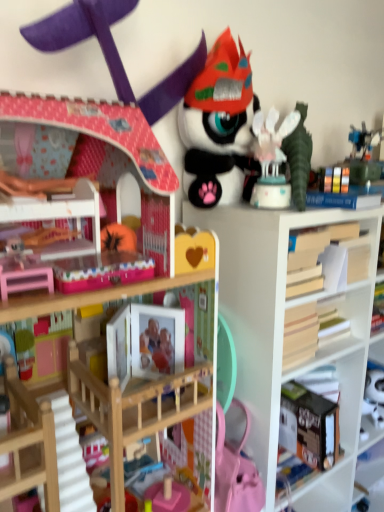
Question: Based on their positions, is wooden book at right located to the left or right of matte pink dollhouse at upper left, the third toy when ordered from right to left?

Choices:
 (A) right
 (B) left

Answer: (A)

Question: From a real-world perspective, is wooden book at right physically located above or below matte pink dollhouse at upper left, the third toy when ordered from right to left?

Choices:
 (A) above
 (B) below

Answer: (B)

Question: Which of these objects is positioned closest to the white matte bookshelf at center?

Choices:
 (A) wooden bookcase at upper left
 (B) wooden book at right
 (C) matte pink dollhouse at upper left, the third toy when ordered from right to left
 (D) matte black plush toy at upper center, the second toy in the right-to-left sequence
 (E) white glossy cake at upper right, the first toy viewed from the right

Answer: (B)

Question: Which object is the closest to the white glossy cake at upper right, placed as the 3th toy when sorted from left to right?

Choices:
 (A) wooden bookcase at upper left
 (B) matte pink dollhouse at upper left, the third toy when ordered from right to left
 (C) matte black plush toy at upper center, the 2th toy viewed from the left
 (D) white matte bookshelf at center
 (E) wooden book at right

Answer: (C)